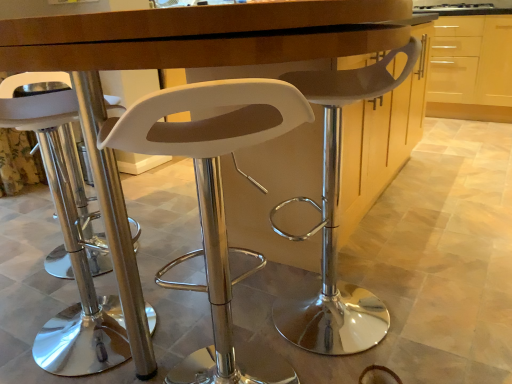
Question: From a real-world perspective, is white plastic stool at center, marked as the 1th chair in a right-to-left arrangement, on top of light wood cabinet at upper right?

Choices:
 (A) yes
 (B) no

Answer: (A)

Question: Does white plastic stool at center, which is counted as the 3th chair, starting from the left, turn towards light wood cabinet at upper right?

Choices:
 (A) no
 (B) yes

Answer: (A)

Question: Does white plastic stool at center, which is counted as the 3th chair, starting from the left, have a lesser width compared to light wood cabinet at upper right?

Choices:
 (A) yes
 (B) no

Answer: (B)

Question: Is white plastic stool at center, which is counted as the 3th chair, starting from the left, facing away from light wood cabinet at upper right?

Choices:
 (A) no
 (B) yes

Answer: (A)

Question: Considering the relative sizes of white plastic stool at center, marked as the 1th chair in a right-to-left arrangement, and light wood cabinet at upper right in the image provided, is white plastic stool at center, marked as the 1th chair in a right-to-left arrangement, shorter than light wood cabinet at upper right?

Choices:
 (A) yes
 (B) no

Answer: (A)

Question: In terms of height, does light wood cabinet at upper right look taller or shorter compared to white plastic stool at left, which is counted as the first chair, starting from the left?

Choices:
 (A) tall
 (B) short

Answer: (A)

Question: In the image, is light wood cabinet at upper right on the left side or the right side of white plastic stool at left, which is counted as the first chair, starting from the left?

Choices:
 (A) right
 (B) left

Answer: (A)

Question: Based on their sizes in the image, would you say light wood cabinet at upper right is bigger or smaller than white plastic stool at left, positioned as the 3th chair in right-to-left order?

Choices:
 (A) small
 (B) big

Answer: (B)

Question: From a real-world perspective, is light wood cabinet at upper right positioned above or below white plastic stool at left, which is counted as the first chair, starting from the left?

Choices:
 (A) above
 (B) below

Answer: (A)

Question: Is white plastic stool at center, marked as the 1th chair in a right-to-left arrangement, inside or outside of white plastic stool at center, acting as the 2th chair starting from the left?

Choices:
 (A) inside
 (B) outside

Answer: (B)

Question: Is white plastic stool at center, which is counted as the 3th chair, starting from the left, taller or shorter than white plastic stool at center, acting as the 2th chair starting from the left?

Choices:
 (A) short
 (B) tall

Answer: (B)

Question: Based on their positions, is white plastic stool at center, marked as the 1th chair in a right-to-left arrangement, located to the left or right of white plastic stool at center, which ranks as the 2th chair in right-to-left order?

Choices:
 (A) right
 (B) left

Answer: (A)

Question: From a real-world perspective, is white plastic stool at center, marked as the 1th chair in a right-to-left arrangement, positioned above or below white plastic stool at center, which ranks as the 2th chair in right-to-left order?

Choices:
 (A) above
 (B) below

Answer: (A)

Question: Is point (159, 117) closer or farther from the camera than point (437, 56)?

Choices:
 (A) closer
 (B) farther

Answer: (A)

Question: Considering the positions of white plastic stool at center, which ranks as the 2th chair in right-to-left order, and light wood cabinet at upper right in the image, is white plastic stool at center, which ranks as the 2th chair in right-to-left order, taller or shorter than light wood cabinet at upper right?

Choices:
 (A) short
 (B) tall

Answer: (A)